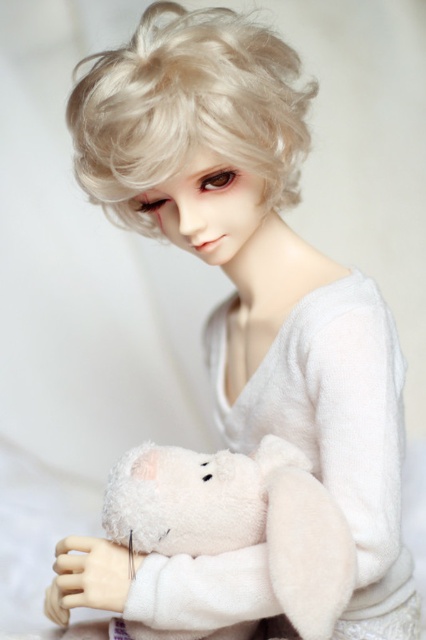
Does white fluffy robe at center have a larger size compared to white plush bear at center?

Correct, white fluffy robe at center is larger in size than white plush bear at center.

Based on the photo, is white fluffy robe at center taller than white plush bear at center?

Correct, white fluffy robe at center is much taller as white plush bear at center.

Locate an element on the screen. Image resolution: width=426 pixels, height=640 pixels. white fluffy robe at center is located at coordinates (336, 429).

Is blonde curly wig at upper center closer to the viewer compared to white plush bear at center?

No, blonde curly wig at upper center is further to the viewer.

Does point (279, 106) come farther from viewer compared to point (331, 566)?

Yes, it is.

Measure the distance between blonde curly wig at upper center and camera.

blonde curly wig at upper center and camera are 76.04 centimeters apart.

I want to click on blonde curly wig at upper center, so click(x=187, y=108).

Does white fluffy robe at center appear on the left side of blonde curly wig at upper center?

Incorrect, white fluffy robe at center is not on the left side of blonde curly wig at upper center.

Between point (379, 596) and point (108, 168), which one is positioned in front?

Point (108, 168) is in front.

The width and height of the screenshot is (426, 640). In order to click on white fluffy robe at center in this screenshot , I will do `click(336, 429)`.